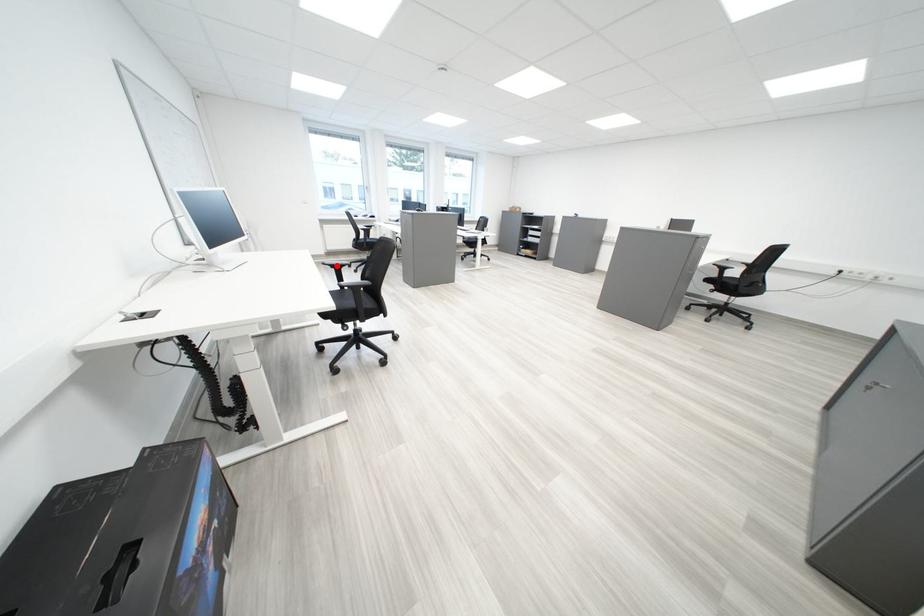
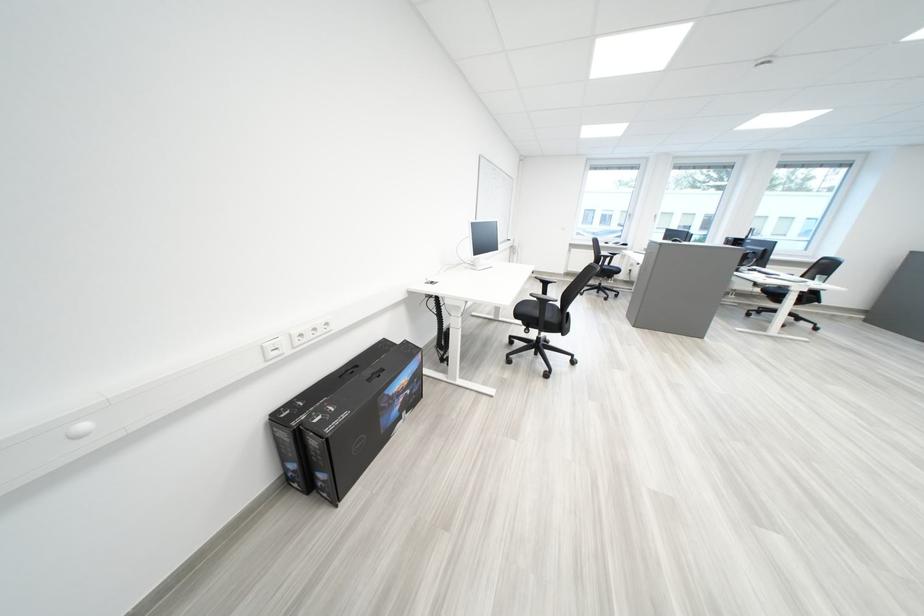
Question: A red point is marked in image1. In image2, is the corresponding 3D point closer to the camera or farther? Reply with the corresponding letter.

Choices:
 (A) The corresponding 3D point is closer.
 (B) The corresponding 3D point is farther.

Answer: (B)